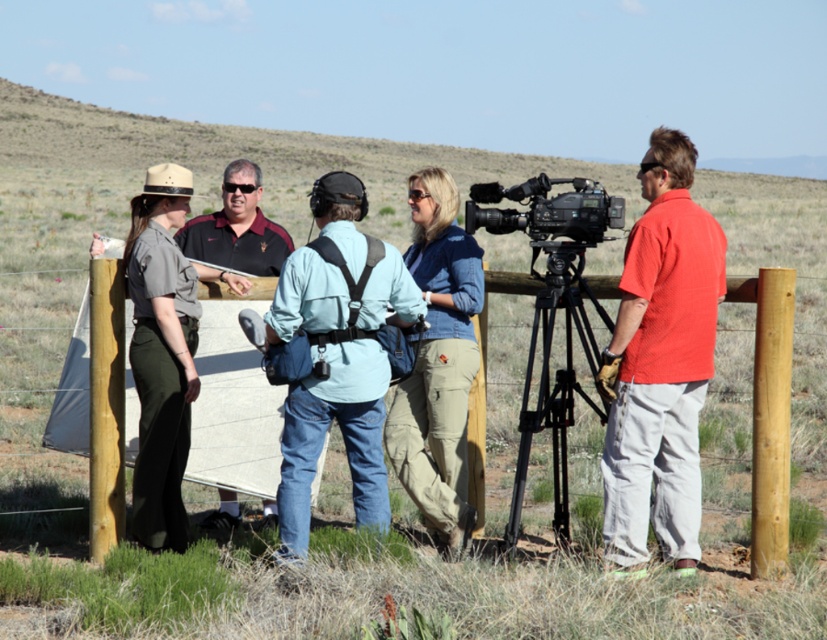
Question: Can you confirm if denim jacket at center is positioned above gray uniform at center?

Choices:
 (A) no
 (B) yes

Answer: (B)

Question: Which of the following is the farthest from the observer?

Choices:
 (A) denim jacket at center
 (B) red cotton shirt at right

Answer: (A)

Question: Which of these objects is positioned closest to the black metal tripod at center?

Choices:
 (A) black plastic camera at right
 (B) light brown wooden post at right
 (C) brown wood post at left

Answer: (A)

Question: Which point is farther to the camera?

Choices:
 (A) gray uniform at center
 (B) wooden fence at center
 (C) matte black shirt at center
 (D) denim jacket at center

Answer: (C)

Question: Does red cotton shirt at right have a greater width compared to light brown wooden post at right?

Choices:
 (A) yes
 (B) no

Answer: (A)

Question: Does gray uniform at center have a lesser width compared to matte black shirt at center?

Choices:
 (A) no
 (B) yes

Answer: (B)